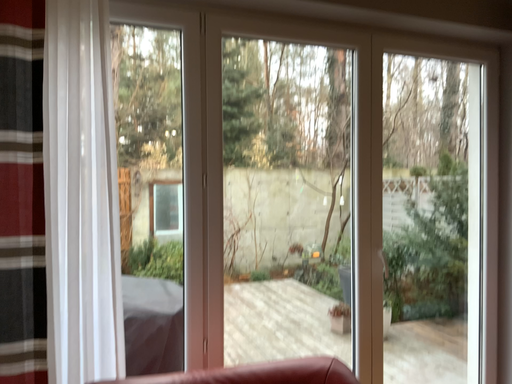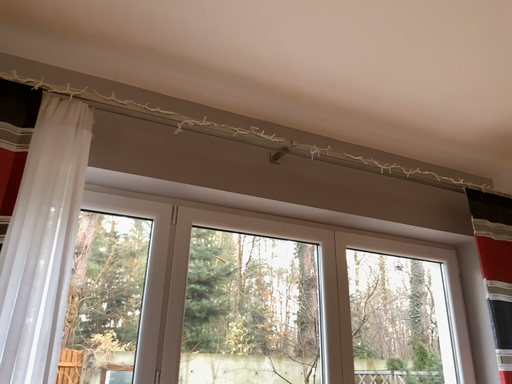
Question: How did the camera likely rotate when shooting the video?

Choices:
 (A) rotated downward
 (B) rotated upward

Answer: (B)